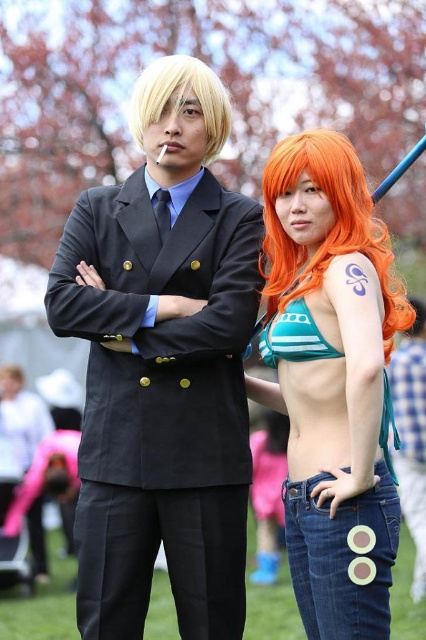
Question: Is orange hair at right closer to the viewer compared to orange synthetic wig at right?

Choices:
 (A) yes
 (B) no

Answer: (A)

Question: Which point is farther to the camera?

Choices:
 (A) orange synthetic wig at right
 (B) orange hair at right
 (C) blonde synthetic wig at center
 (D) matte black suit at center

Answer: (C)

Question: Which object is the closest to the matte black suit at center?

Choices:
 (A) blonde synthetic wig at center
 (B) orange hair at right
 (C) orange synthetic wig at right

Answer: (B)

Question: Does orange hair at right have a lesser width compared to orange synthetic wig at right?

Choices:
 (A) no
 (B) yes

Answer: (B)

Question: Can you confirm if matte black suit at center is bigger than orange synthetic wig at right?

Choices:
 (A) no
 (B) yes

Answer: (A)

Question: Which point appears farthest from the camera in this image?

Choices:
 (A) (282, 141)
 (B) (101, 572)
 (C) (265, 211)

Answer: (C)